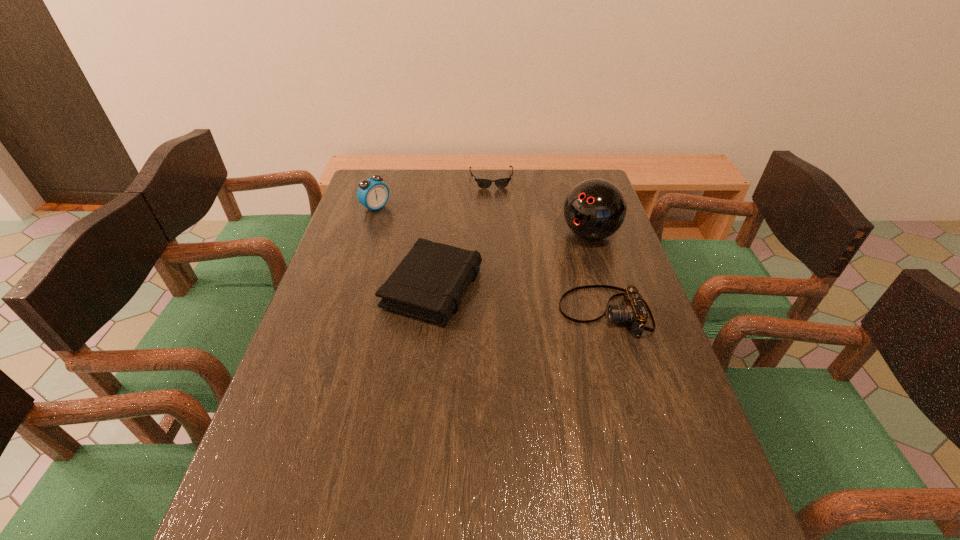
At what (x,y) coordinates should I click in order to perform the action: click on vacant space situated on the face of the second tallest object. Please return your answer as a coordinate pair (x, y). This screenshot has width=960, height=540. Looking at the image, I should click on (434, 244).

Where is `sunglasses positioned at the far edge`? This screenshot has height=540, width=960. sunglasses positioned at the far edge is located at coordinates (482, 183).

Locate an element on the screen. The image size is (960, 540). alarm clock present at the far edge is located at coordinates (372, 193).

I want to click on object that is at the left edge, so click(x=372, y=193).

What are the coordinates of `camera that is positioned at the right edge` in the screenshot? It's located at (634, 311).

What are the coordinates of `bowling ball that is positioned at the right edge` in the screenshot? It's located at (594, 209).

Identify the location of object that is at the far left corner. (372, 193).

Identify the location of vacant space at the far edge. The height and width of the screenshot is (540, 960). (467, 178).

This screenshot has height=540, width=960. In the image, there is a desktop. In order to click on vacant space at the near edge in this screenshot , I will do `click(380, 497)`.

In the image, there is a desktop. At what (x,y) coordinates should I click in order to perform the action: click on vacant space at the left edge. Please return your answer as a coordinate pair (x, y). This screenshot has height=540, width=960. Looking at the image, I should click on (316, 443).